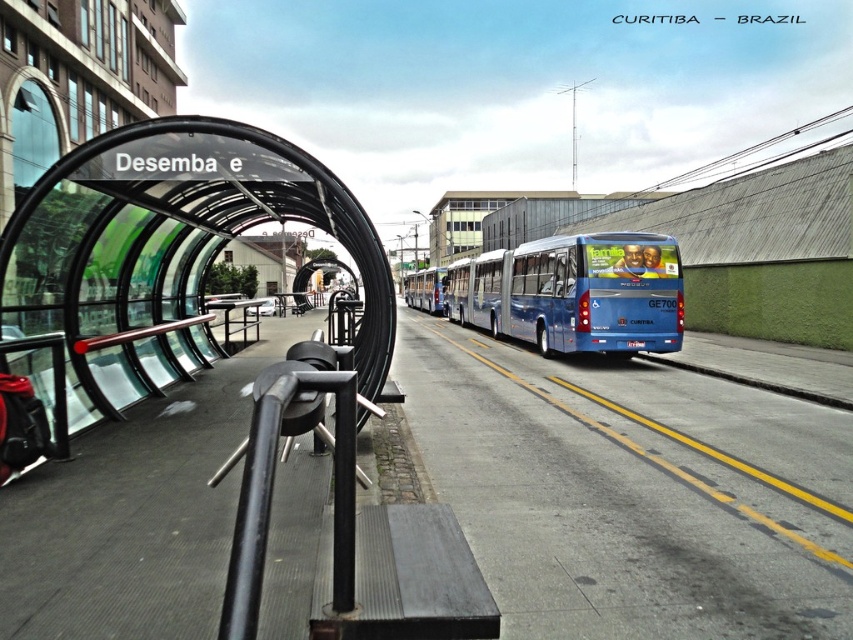
Question: Where is blue metallic bus at center located in relation to gray concrete curb at lower right in the image?

Choices:
 (A) below
 (B) above

Answer: (B)

Question: Does blue metallic bus at center come in front of gray concrete curb at lower right?

Choices:
 (A) yes
 (B) no

Answer: (B)

Question: Which object appears farthest from the camera in this image?

Choices:
 (A) gray concrete curb at lower right
 (B) blue metallic bus at center

Answer: (B)

Question: Is blue metallic bus at center above gray concrete curb at lower right?

Choices:
 (A) no
 (B) yes

Answer: (B)

Question: Which of the following is the farthest from the observer?

Choices:
 (A) gray concrete curb at lower right
 (B) blue metallic bus at center

Answer: (B)